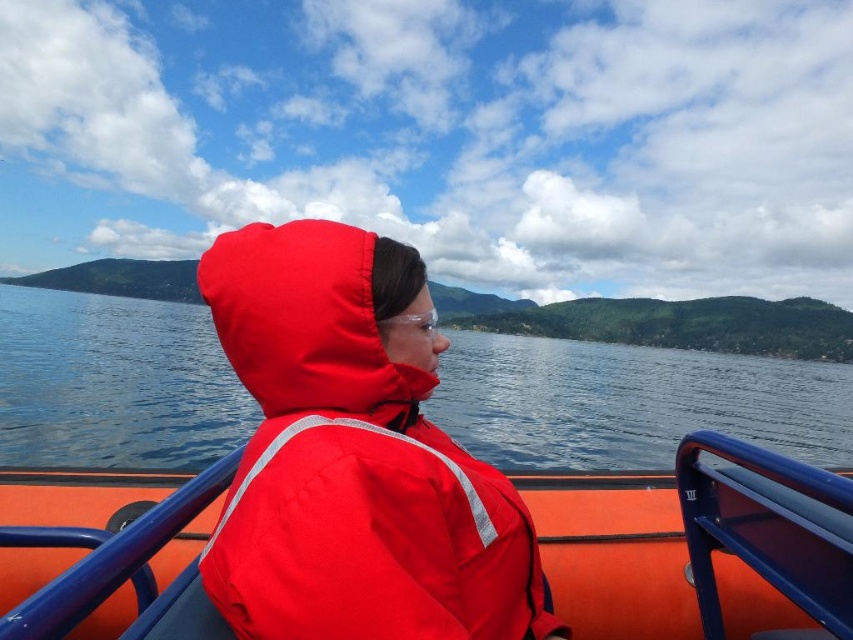
You are planning to take a photo of the blue water at center and the matte red jacket at center. Which object should you focus on first if you want to capture both in the same frame without moving the camera?

The blue water at center is wider than the matte red jacket at center, so you should focus on the blue water at center first to ensure it fits within the frame.

You are standing on the boat and looking at two points marked in the image. Which point, point (x=148, y=515) or point (x=509, y=577), is nearer to you?

Point (x=148, y=515) is closer to the viewer than point (x=509, y=577).

In the scene shown: You are a safety inspector checking the boat setup. The boat has blue water at center and a matte red life jacket at center. According to regulations, the life jacket must be placed where it is not submerged by the water. Is the current placement compliant?

The blue water at center has a larger width than the matte red life jacket at center, which means the life jacket is placed in an area where it might be submerged by the water. Therefore, the current placement is not compliant with safety regulations.